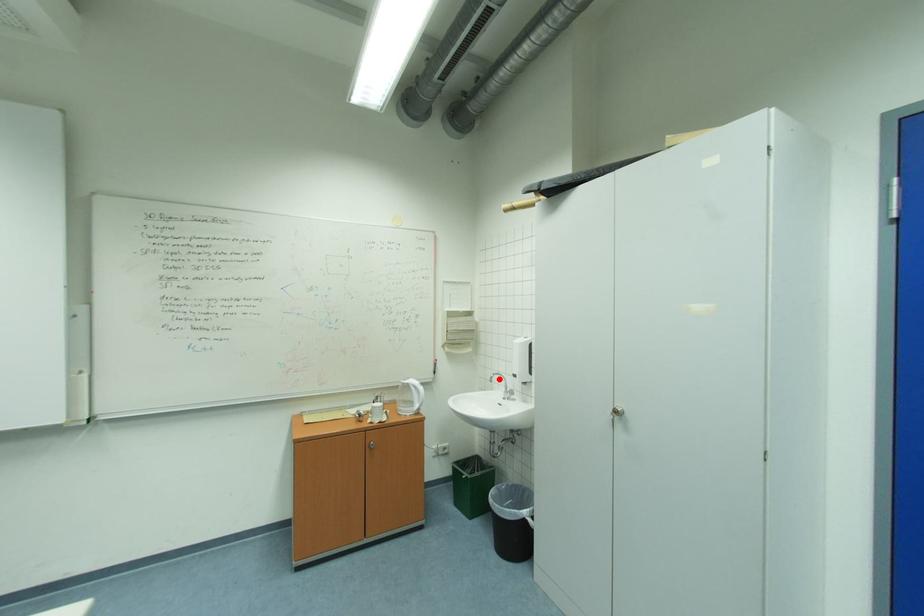
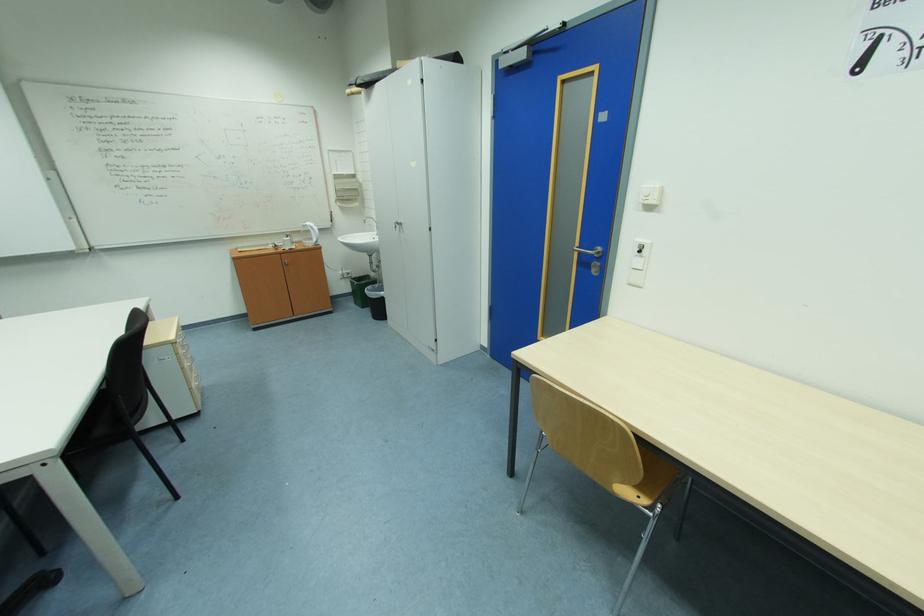
Question: I am providing you with two images of the same scene from different viewpoints. A red point is shown in image1. For the corresponding object point in image2, is it positioned nearer or farther from the camera?

Choices:
 (A) Nearer
 (B) Farther

Answer: (A)